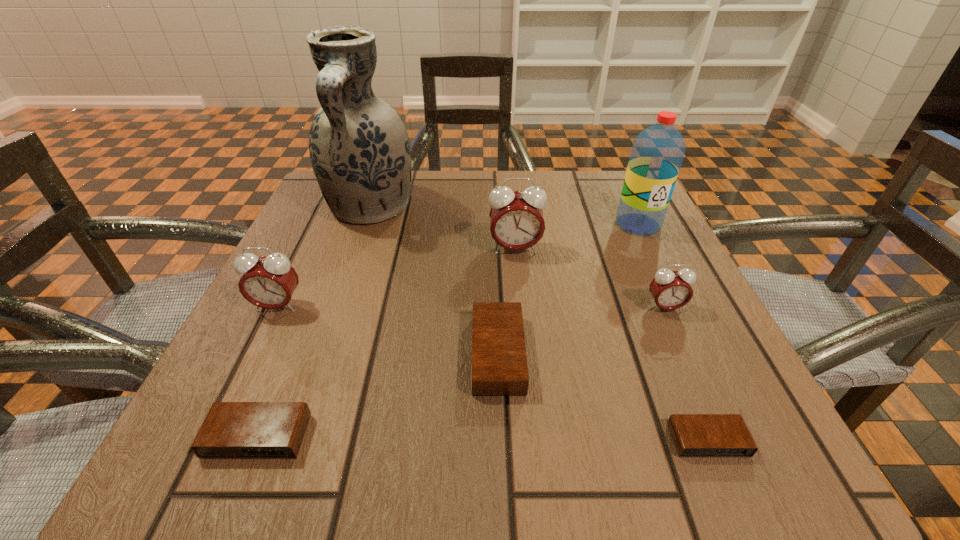
Where is `blue vase`? blue vase is located at coordinates (359, 147).

The width and height of the screenshot is (960, 540). In order to click on vase in this screenshot , I will do `click(359, 147)`.

Identify the location of water bottle. The image size is (960, 540). (657, 153).

Find the location of a particular element. The height and width of the screenshot is (540, 960). red water bottle is located at coordinates coord(657,153).

At what (x,y) coordinates should I click in order to perform the action: click on the third farthest object. Please return your answer as a coordinate pair (x, y). Image resolution: width=960 pixels, height=540 pixels. Looking at the image, I should click on (516, 218).

The width and height of the screenshot is (960, 540). Identify the location of the second pink alarm clock from left to right. (516, 218).

At what (x,y) coordinates should I click in order to perform the action: click on the fifth shortest alarm clock. Please return your answer as a coordinate pair (x, y). The height and width of the screenshot is (540, 960). Looking at the image, I should click on (268, 282).

Where is `the leftmost pink alarm clock`? This screenshot has height=540, width=960. the leftmost pink alarm clock is located at coordinates (268, 282).

The width and height of the screenshot is (960, 540). In order to click on the rightmost pink alarm clock in this screenshot , I will do `click(671, 290)`.

Locate an element on the screen. This screenshot has width=960, height=540. the fourth shortest object is located at coordinates (671, 290).